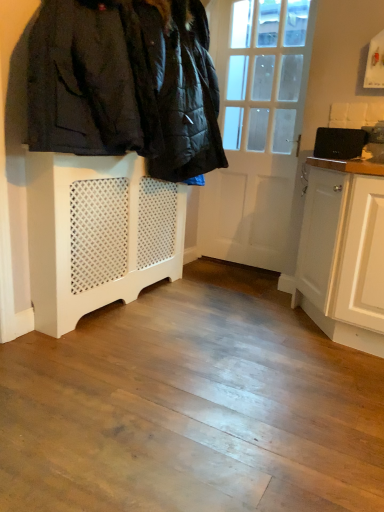
Question: Does white wooden door at center have a smaller size compared to white painted wood radiator at lower left?

Choices:
 (A) yes
 (B) no

Answer: (A)

Question: Is white wooden door at center next to white painted wood radiator at lower left and touching it?

Choices:
 (A) no
 (B) yes

Answer: (A)

Question: Can we say white wooden door at center lies outside white painted wood radiator at lower left?

Choices:
 (A) yes
 (B) no

Answer: (A)

Question: Can you confirm if white wooden door at center is shorter than white painted wood radiator at lower left?

Choices:
 (A) no
 (B) yes

Answer: (A)

Question: Can you confirm if white wooden door at center is positioned to the right of white painted wood radiator at lower left?

Choices:
 (A) yes
 (B) no

Answer: (A)

Question: Are white wooden door at center and white painted wood radiator at lower left far apart?

Choices:
 (A) no
 (B) yes

Answer: (B)

Question: Is white painted wood radiator at lower left at the right side of black matte laptop at upper right?

Choices:
 (A) no
 (B) yes

Answer: (A)

Question: From a real-world perspective, is white painted wood radiator at lower left located beneath black matte laptop at upper right?

Choices:
 (A) no
 (B) yes

Answer: (B)

Question: Considering the relative sizes of white painted wood radiator at lower left and black matte laptop at upper right in the image provided, is white painted wood radiator at lower left thinner than black matte laptop at upper right?

Choices:
 (A) no
 (B) yes

Answer: (A)

Question: Is the position of white painted wood radiator at lower left less distant than that of black matte laptop at upper right?

Choices:
 (A) no
 (B) yes

Answer: (B)

Question: From a real-world perspective, is white painted wood radiator at lower left positioned over black matte laptop at upper right based on gravity?

Choices:
 (A) yes
 (B) no

Answer: (B)

Question: Is white painted wood radiator at lower left positioned beyond the bounds of black matte laptop at upper right?

Choices:
 (A) no
 (B) yes

Answer: (B)

Question: Is white painted wood radiator at lower left located outside white lattice radiator at left?

Choices:
 (A) no
 (B) yes

Answer: (B)